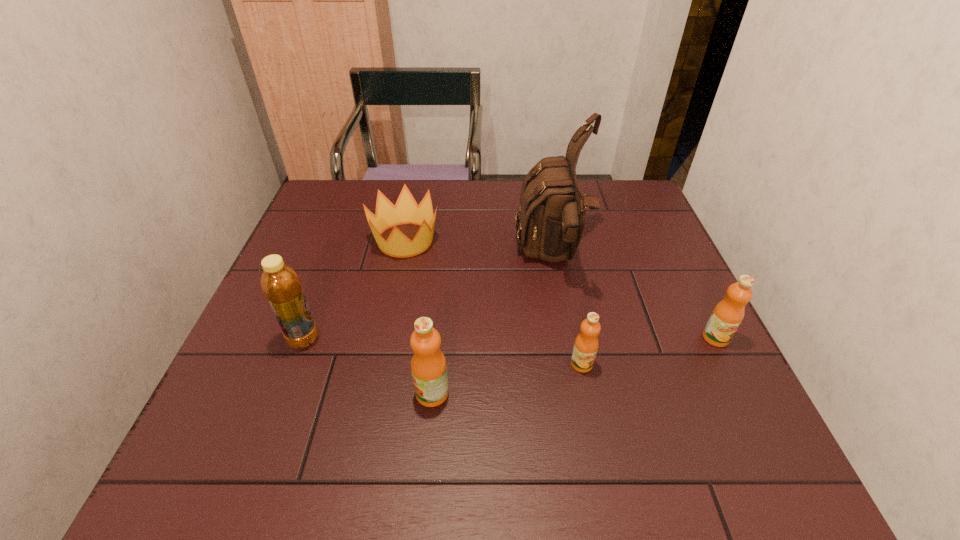
Please point a vacant point for placing a orange juice on the left. Please provide its 2D coordinates. Your answer should be formatted as a tuple, i.e. [(x, y)], where the tuple contains the x and y coordinates of a point satisfying the conditions above.

[(264, 426)]